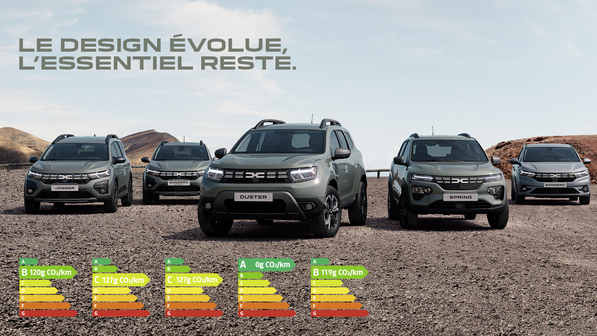
Where is `dark green bar`? dark green bar is located at coordinates (33, 260), (98, 259), (163, 259), (249, 263), (313, 257).